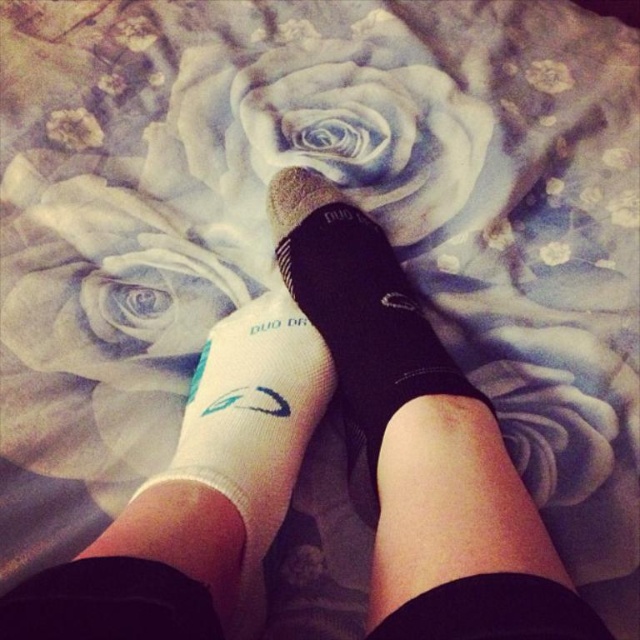
Is white fabric rose at upper center closer to the viewer compared to white fabric sock at lower center?

No.

Image resolution: width=640 pixels, height=640 pixels. Describe the element at coordinates (328, 125) in the screenshot. I see `white fabric rose at upper center` at that location.

Find the location of a particular element. Image resolution: width=640 pixels, height=640 pixels. white fabric rose at upper center is located at coordinates (328, 125).

How much distance is there between black textured socks at center and white fabric rose at upper center?

26.58 centimeters

Does black textured socks at center appear under white fabric rose at upper center?

Correct, black textured socks at center is located below white fabric rose at upper center.

The image size is (640, 640). Describe the element at coordinates (420, 442) in the screenshot. I see `black textured socks at center` at that location.

You are a GUI agent. You are given a task and a screenshot of the screen. Output one action in this format:
    pyautogui.click(x=<x>, y=<y>)
    Task: Click on the black textured socks at center
    The width and height of the screenshot is (640, 640).
    Given the screenshot: What is the action you would take?
    pyautogui.click(x=420, y=442)

Is black textured socks at center wider than white fabric sock at lower center?

Yes.

Which is behind, point (545, 576) or point (305, 321)?

Point (305, 321)

Locate an element on the screen. This screenshot has width=640, height=640. black textured socks at center is located at coordinates (420, 442).